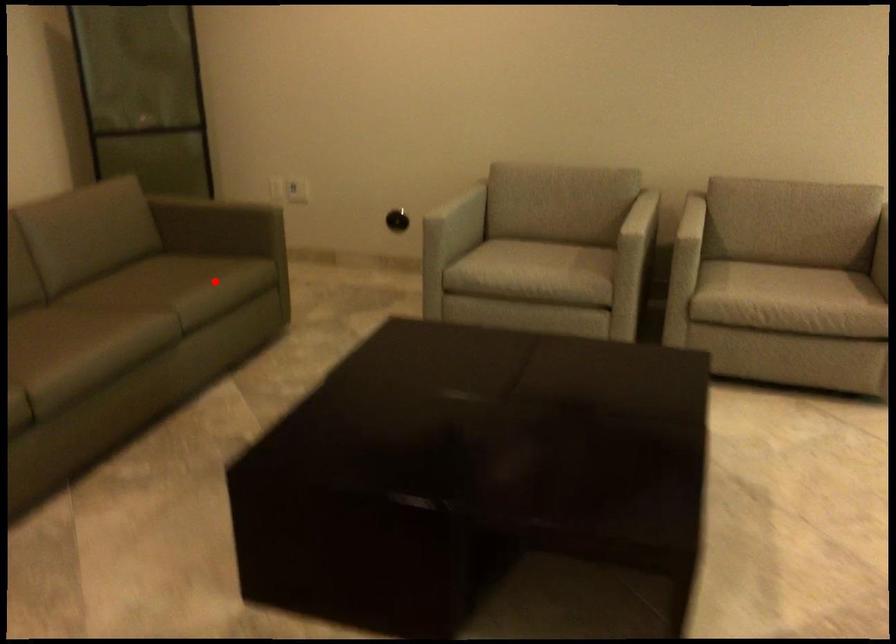
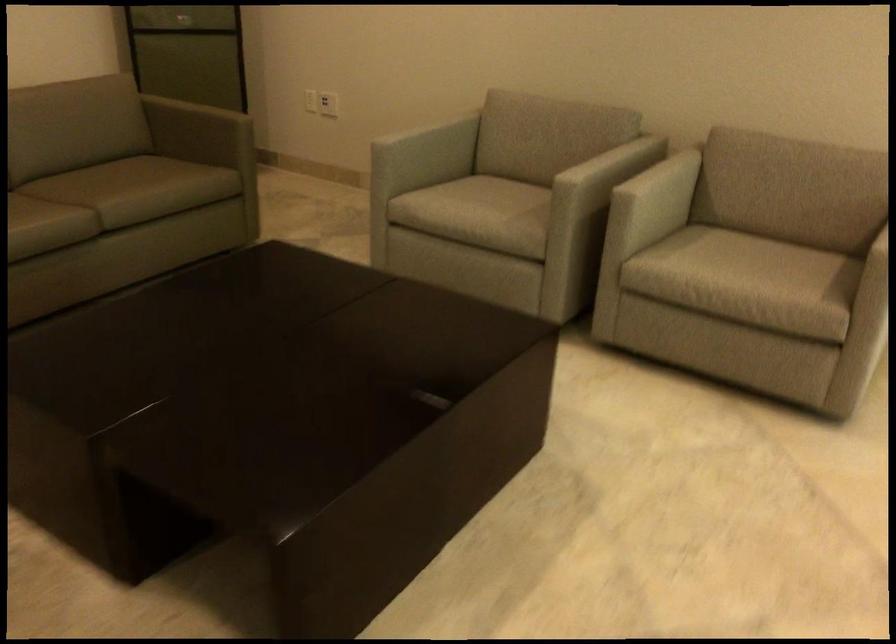
In the second image, find the point that corresponds to the highlighted location in the first image.

(145, 187)